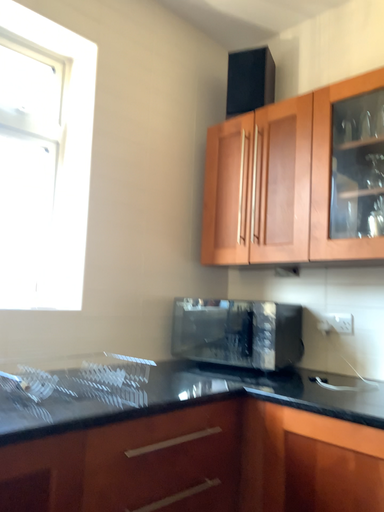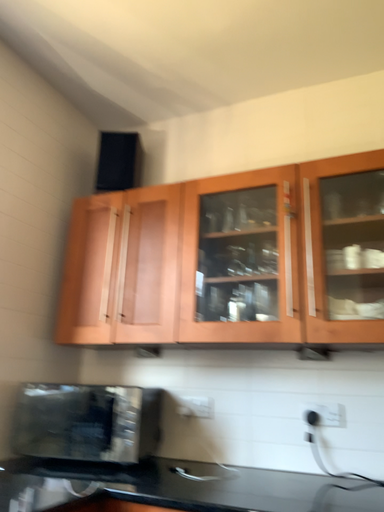
Question: How did the camera likely rotate when shooting the video?

Choices:
 (A) rotated downward
 (B) rotated upward

Answer: (B)